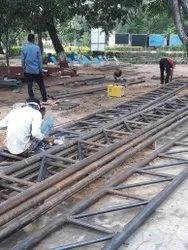
You are a GUI agent. You are given a task and a screenshot of the screen. Output one action in this format:
    pyautogui.click(x=<x>, y=<y>)
    Task: Click on the bucket
    
    Given the screenshot: What is the action you would take?
    pyautogui.click(x=115, y=92)